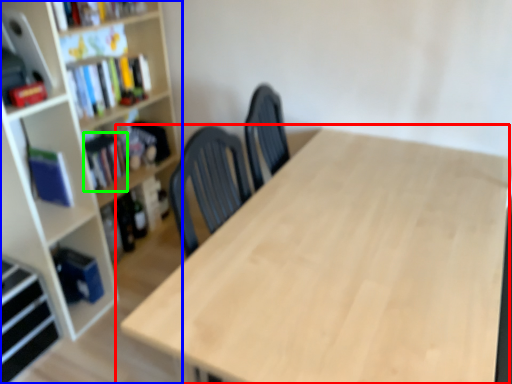
Question: Considering the real-world distances, which object is farthest from table (highlighted by a red box)? bookcase (highlighted by a blue box) or book (highlighted by a green box)?

Choices:
 (A) bookcase
 (B) book

Answer: (B)